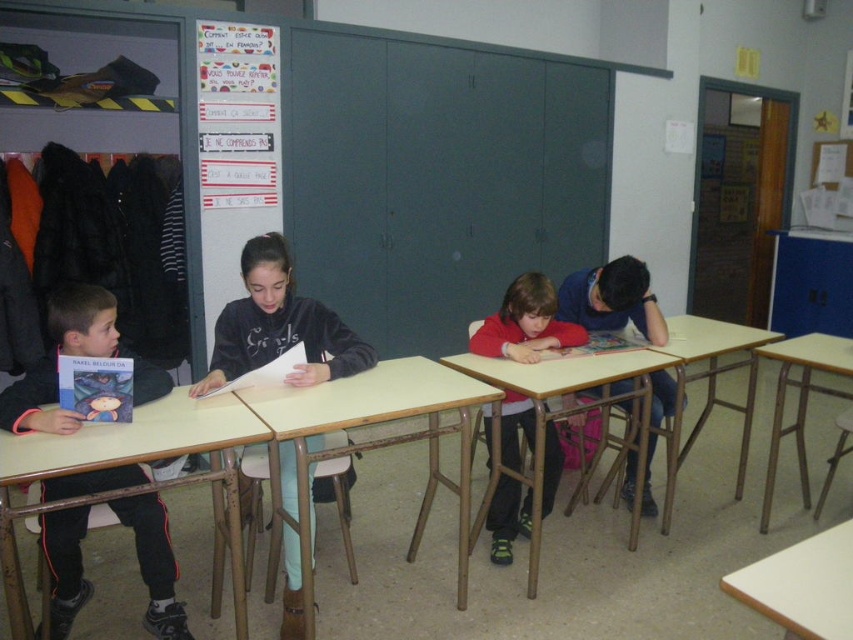
Does point (537, 477) lie behind point (798, 588)?

Yes, point (537, 477) is farther from viewer.

Is wooden desk at center positioned behind white matte table at lower right?

Yes, wooden desk at center is behind white matte table at lower right.

Locate an element on the screen. The width and height of the screenshot is (853, 640). wooden desk at center is located at coordinates (572, 390).

Between blue cotton shirt at center and wooden at right, which one appears on the right side from the viewer's perspective?

From the viewer's perspective, wooden at right appears more on the right side.

Identify the location of blue cotton shirt at center. (612, 300).

Locate an element on the screen. The width and height of the screenshot is (853, 640). blue cotton shirt at center is located at coordinates pyautogui.click(x=612, y=300).

Does red matte sweater at center appear under wooden desk at center?

No.

Does red matte sweater at center lie in front of wooden desk at center?

No, it is not.

Which is behind, point (508, 499) or point (544, 376)?

Point (508, 499)

The image size is (853, 640). I want to click on red matte sweater at center, so coord(526,323).